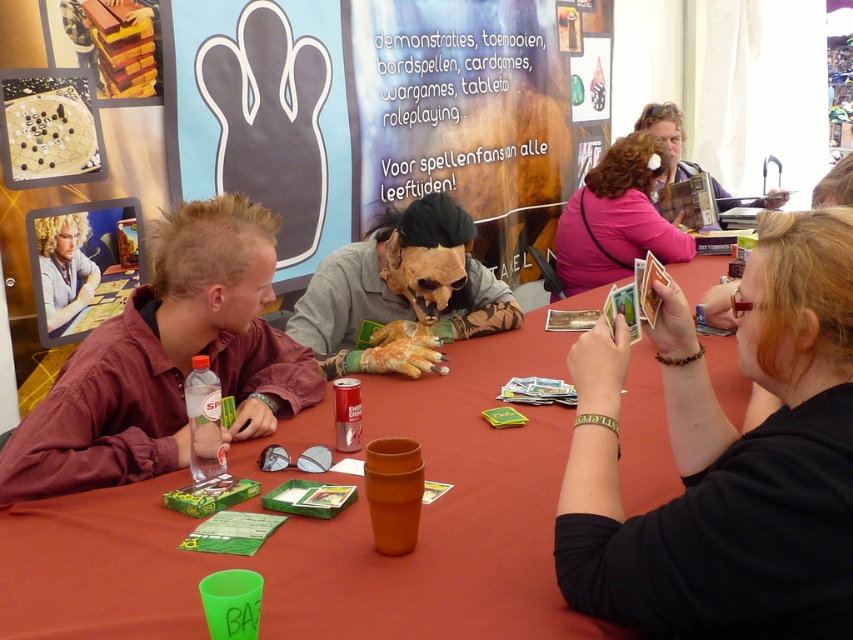
This screenshot has height=640, width=853. I want to click on matte maroon shirt at lower left, so click(167, 362).

Between matte maroon shirt at lower left and pink fabric purse at upper center, which one has more height?

With more height is pink fabric purse at upper center.

Is point (64, 436) more distant than point (625, 148)?

No, it is not.

This screenshot has height=640, width=853. I want to click on matte maroon shirt at lower left, so click(x=167, y=362).

Consider the image. Who is higher up, smooth gray mask at center or matte black hair at upper left?

matte black hair at upper left is higher up.

Locate an element on the screen. The height and width of the screenshot is (640, 853). smooth gray mask at center is located at coordinates (401, 288).

Is point (405, 280) less distant than point (74, 284)?

That is True.

This screenshot has height=640, width=853. I want to click on smooth gray mask at center, so click(401, 288).

Can you confirm if smooth plastic cup at center is positioned below smooth gray mask at center?

Yes, smooth plastic cup at center is below smooth gray mask at center.

Who is more distant from viewer, (x=274, y=541) or (x=421, y=285)?

Point (x=421, y=285)

Image resolution: width=853 pixels, height=640 pixels. In order to click on smooth plastic cup at center in this screenshot , I will do `click(332, 528)`.